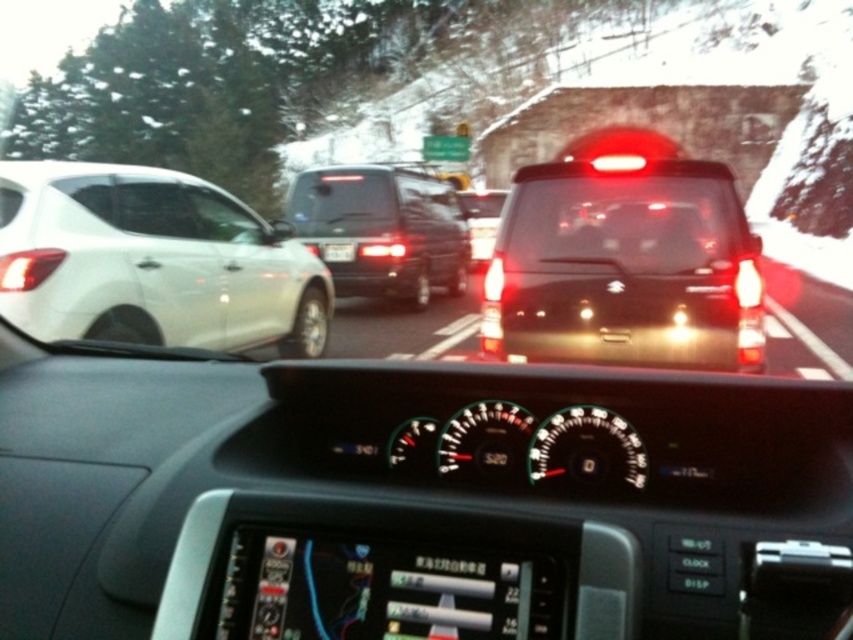
Question: Does white glossy hatchback at left have a smaller size compared to transparent glass windshield at center?

Choices:
 (A) no
 (B) yes

Answer: (A)

Question: Is black matte suv at center smaller than matte black suv at center?

Choices:
 (A) yes
 (B) no

Answer: (A)

Question: Which object is closer to the camera taking this photo?

Choices:
 (A) matte black suv at center
 (B) transparent glass windshield at center
 (C) black plastic license plate at center
 (D) black matte suv at center

Answer: (B)

Question: Among these points, which one is farthest from the camera?

Choices:
 (A) [378, 289]
 (B) [683, 276]

Answer: (A)

Question: Which object is the farthest from the white glossy hatchback at left?

Choices:
 (A) black matte suv at center
 (B) black plastic license plate at center
 (C) white matte windshield at left

Answer: (B)

Question: From the image, what is the correct spatial relationship of transparent glass windshield at center in relation to black matte van at center?

Choices:
 (A) left
 (B) right

Answer: (B)